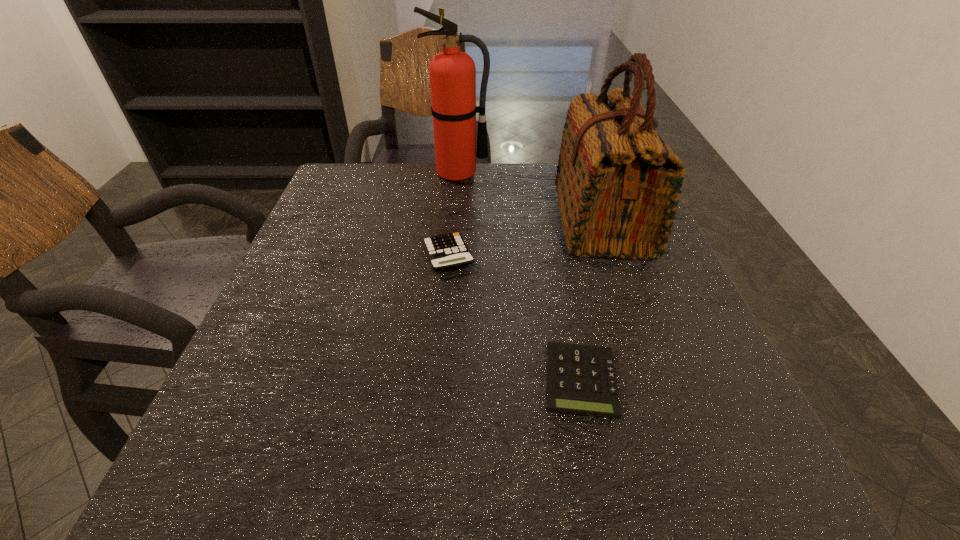
The width and height of the screenshot is (960, 540). What are the coordinates of `vacant space located 0.140m on the left of the taller calculator` in the screenshot? It's located at (356, 256).

The height and width of the screenshot is (540, 960). Identify the location of free spot located on the back of the shorter calculator. (548, 219).

Locate an element on the screen. fire extinguisher located in the far edge section of the desktop is located at coordinates (452, 73).

Find the location of a particular element. shopping bag that is at the far edge is located at coordinates (618, 183).

You are a GUI agent. You are given a task and a screenshot of the screen. Output one action in this format:
    pyautogui.click(x=<x>, y=<y>)
    Task: Click on the object that is at the right edge
    
    Given the screenshot: What is the action you would take?
    pyautogui.click(x=618, y=183)

The image size is (960, 540). Find the location of `object located in the far right corner section of the desktop`. object located in the far right corner section of the desktop is located at coordinates (618, 183).

The width and height of the screenshot is (960, 540). What are the coordinates of `free space at the far edge of the desktop` in the screenshot? It's located at (409, 195).

Identify the location of vacant space at the near edge of the desktop. The image size is (960, 540). (511, 476).

In the image, there is a desktop. Where is `free region at the left edge`? The image size is (960, 540). free region at the left edge is located at coordinates (329, 299).

What are the coordinates of `vacant area at the right edge` in the screenshot? It's located at (642, 403).